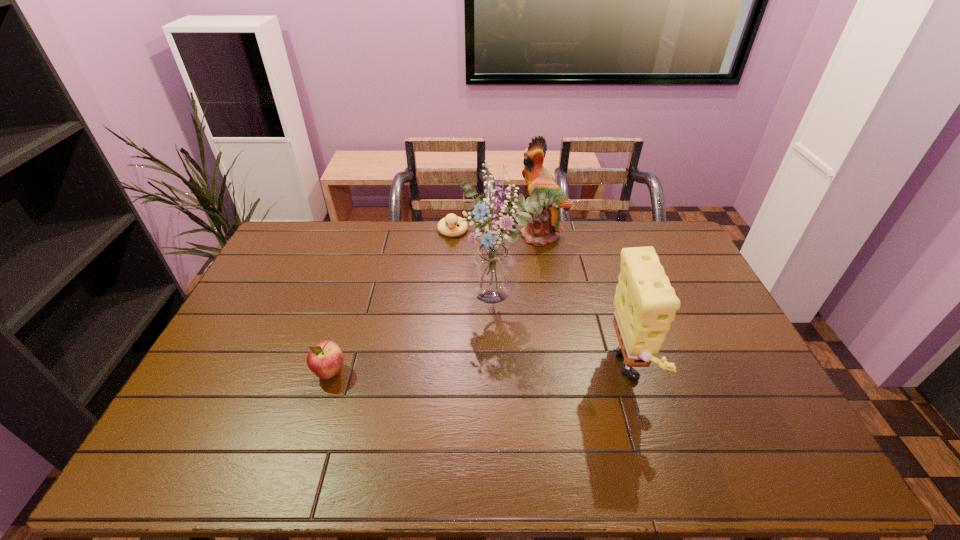
This screenshot has height=540, width=960. What are the coordinates of `the second shortest object` in the screenshot? It's located at (325, 359).

The height and width of the screenshot is (540, 960). I want to click on the leftmost object, so click(325, 359).

Find the location of a particular element. The width and height of the screenshot is (960, 540). the rightmost object is located at coordinates (x=645, y=303).

At what (x,y) coordinates should I click in order to perform the action: click on the third shortest object. Please return your answer as a coordinate pair (x, y). Image resolution: width=960 pixels, height=540 pixels. Looking at the image, I should click on (645, 303).

At what (x,y) coordinates should I click in order to perform the action: click on the third farthest object. Please return your answer as a coordinate pair (x, y). The image size is (960, 540). Looking at the image, I should click on (492, 270).

Identify the location of parrot. (542, 230).

Identify the location of the shortest object. (451, 220).

Locate an element on the screen. This screenshot has height=540, width=960. vacant space located 0.280m on the right of the apple is located at coordinates (447, 373).

Find the location of a particular element. This screenshot has width=960, height=540. vacant area situated 0.110m on the face of the third shortest object is located at coordinates (696, 373).

At what (x,y) coordinates should I click in order to perform the action: click on vacant space situated 0.150m on the front-facing side of the third farthest object. Please return your answer as a coordinate pair (x, y). This screenshot has height=540, width=960. Looking at the image, I should click on (476, 353).